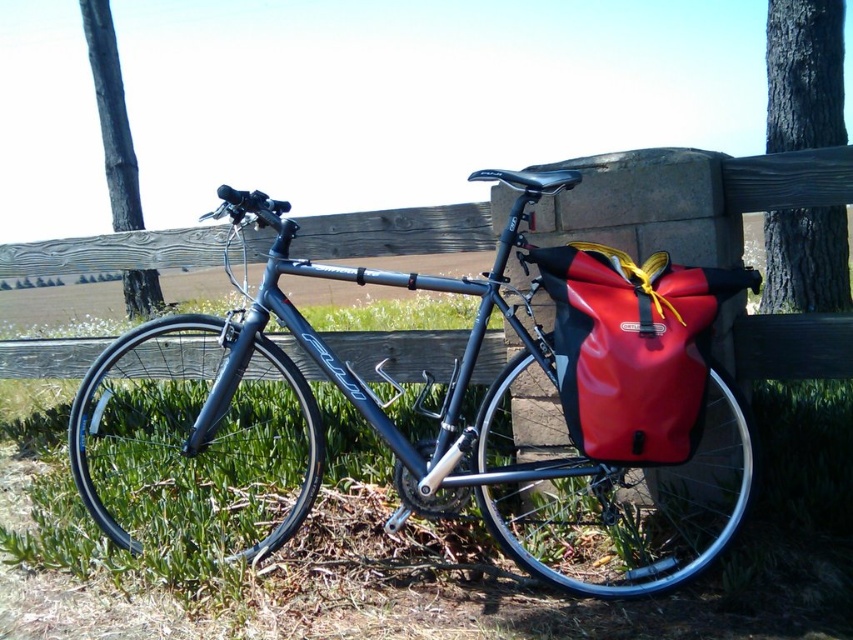
Is wooden at center wider than yellow fabric strap at right?

Correct, the width of wooden at center exceeds that of yellow fabric strap at right.

Does wooden at center have a greater height compared to yellow fabric strap at right?

No, wooden at center is not taller than yellow fabric strap at right.

Between point (788, 179) and point (653, 266), which one is positioned in front?

Positioned in front is point (653, 266).

This screenshot has height=640, width=853. I want to click on wooden at center, so click(x=395, y=230).

Can you confirm if green grass at lower left is thinner than wooden at center?

In fact, green grass at lower left might be wider than wooden at center.

Is point (766, 605) closer to camera compared to point (178, 252)?

Yes, point (766, 605) is closer to viewer.

Find the location of a particular element. green grass at lower left is located at coordinates (560, 595).

Is shiny black bicycle at center to the left of wooden at center from the viewer's perspective?

No, shiny black bicycle at center is not to the left of wooden at center.

Between shiny black bicycle at center and wooden at center, which one is positioned higher?

wooden at center is above.

The height and width of the screenshot is (640, 853). Find the location of `shiny black bicycle at center`. shiny black bicycle at center is located at coordinates (428, 416).